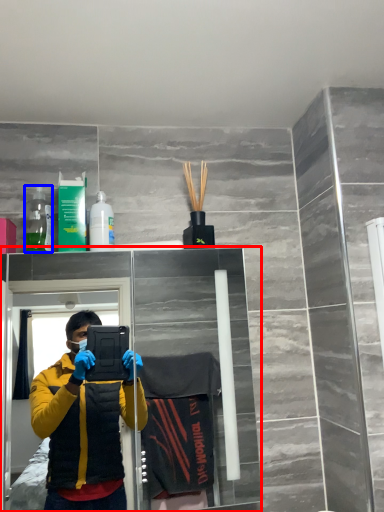
Question: Which object is closer to the camera taking this photo, glass door (highlighted by a red box) or bottle (highlighted by a blue box)?

Choices:
 (A) glass door
 (B) bottle

Answer: (A)